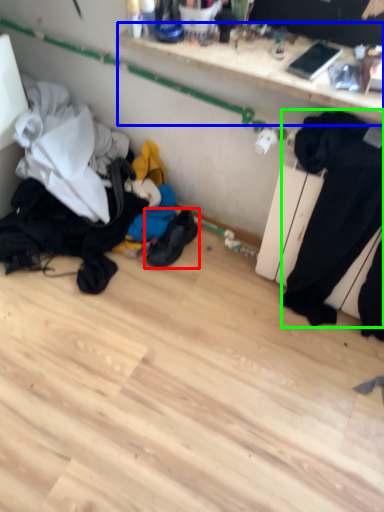
Question: Which object is positioned closest to footwear (highlighted by a red box)? Select from shelf (highlighted by a blue box) and sweat pant (highlighted by a green box).

Choices:
 (A) shelf
 (B) sweat pant

Answer: (B)